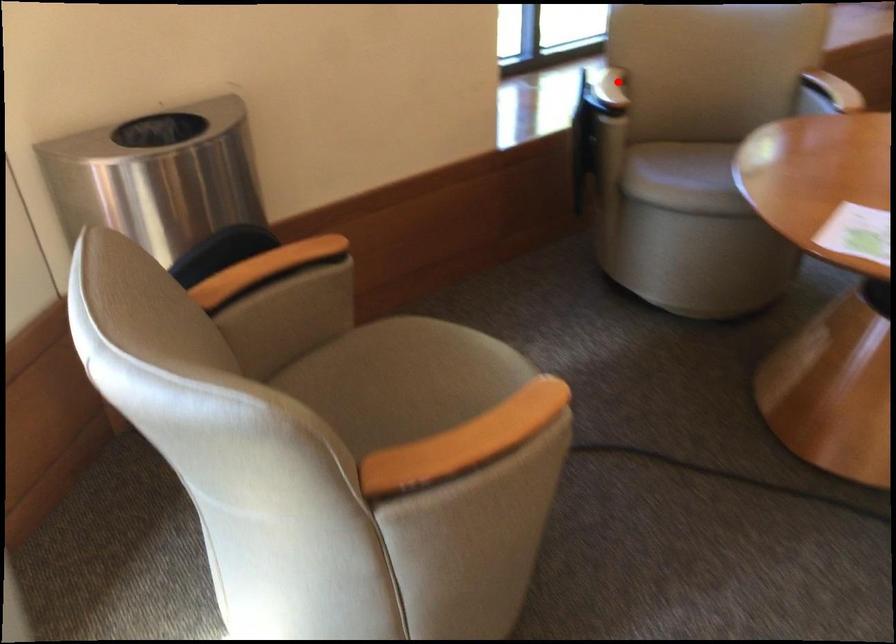
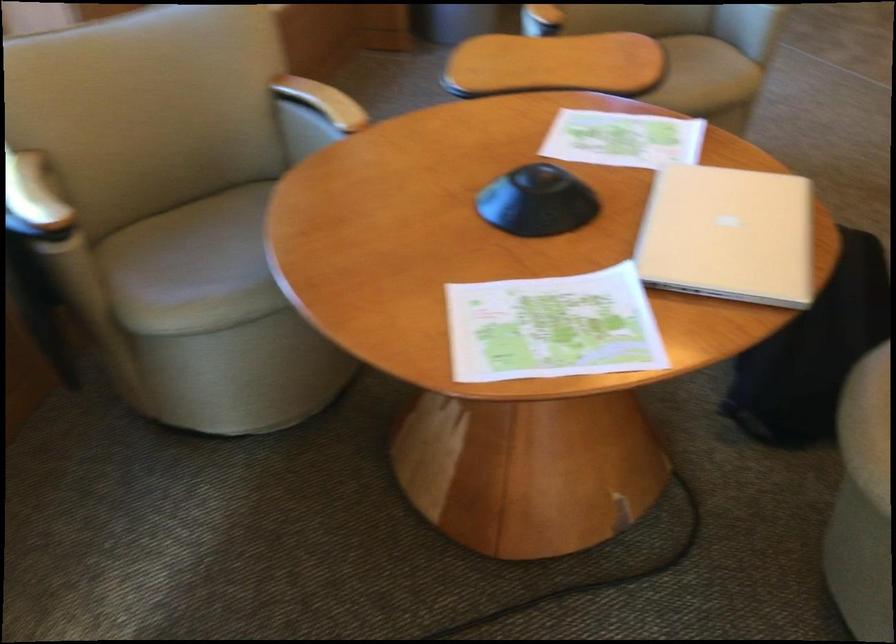
Question: A red point is marked in image1. In image2, is the corresponding 3D point closer to the camera or farther? Reply with the corresponding letter.

Choices:
 (A) The corresponding 3D point is closer.
 (B) The corresponding 3D point is farther.

Answer: (A)